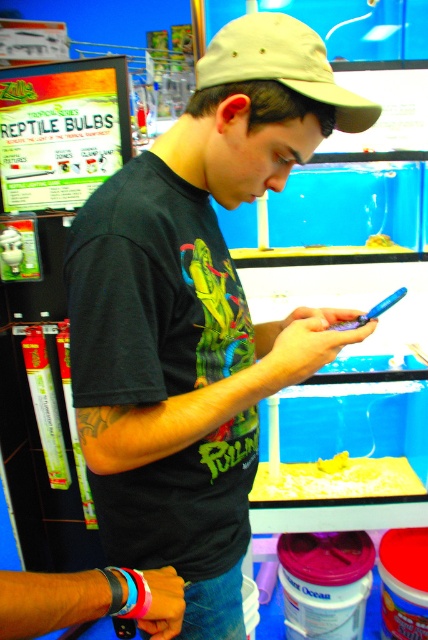
You are a customer in a pet store and you see the beige fabric baseball cap at center and the yellow sand at lower center. Which object is positioned higher in the image?

The beige fabric baseball cap at center is positioned higher than the yellow sand at lower center.